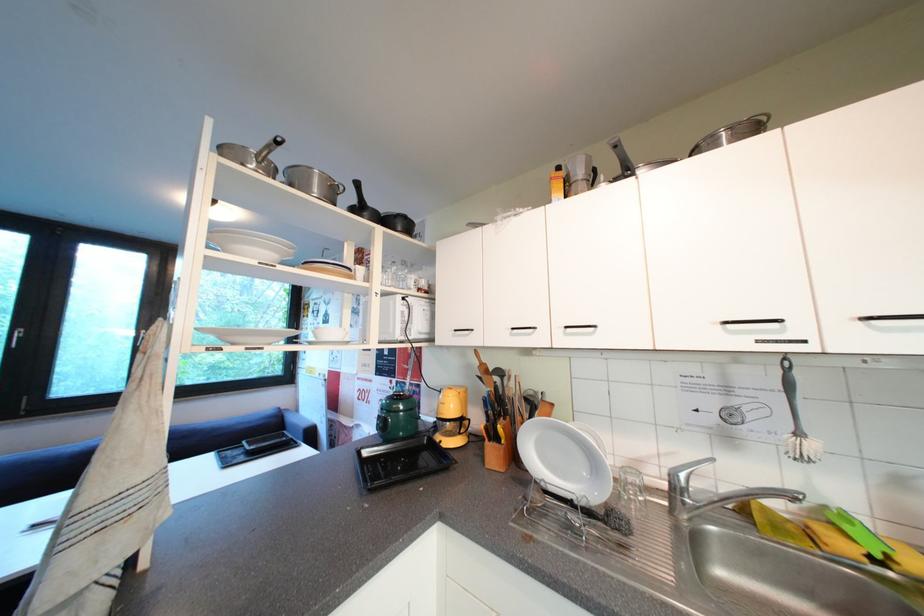
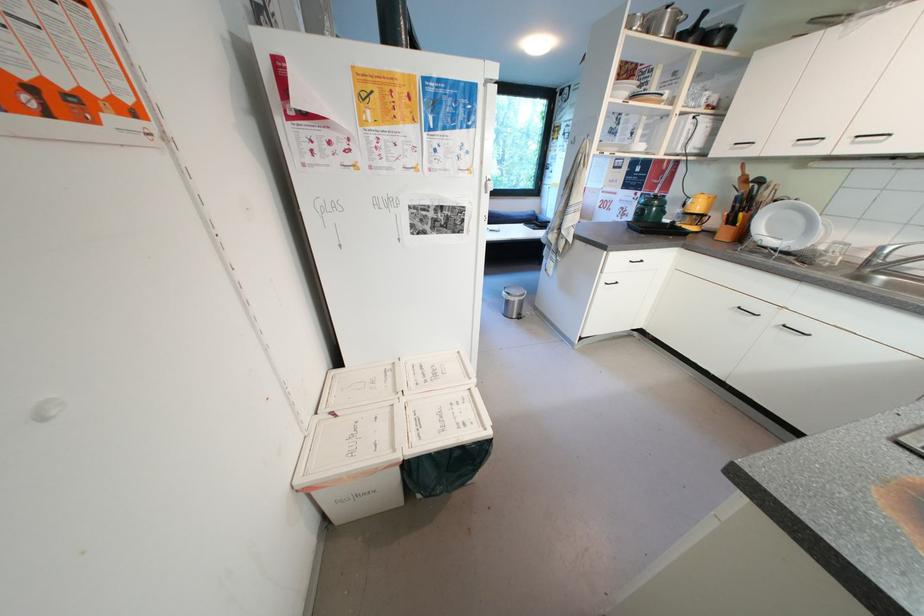
The point at (298, 187) is marked in the first image. Where is the corresponding point in the second image?

(657, 33)